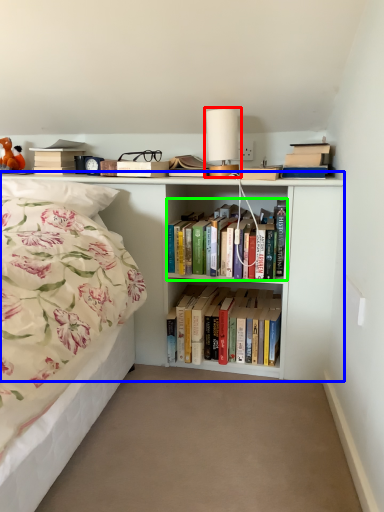
Question: Estimate the real-world distances between objects in this image. Which object is closer to table lamp (highlighted by a red box), bookcase (highlighted by a blue box) or book (highlighted by a green box)?

Choices:
 (A) bookcase
 (B) book

Answer: (B)